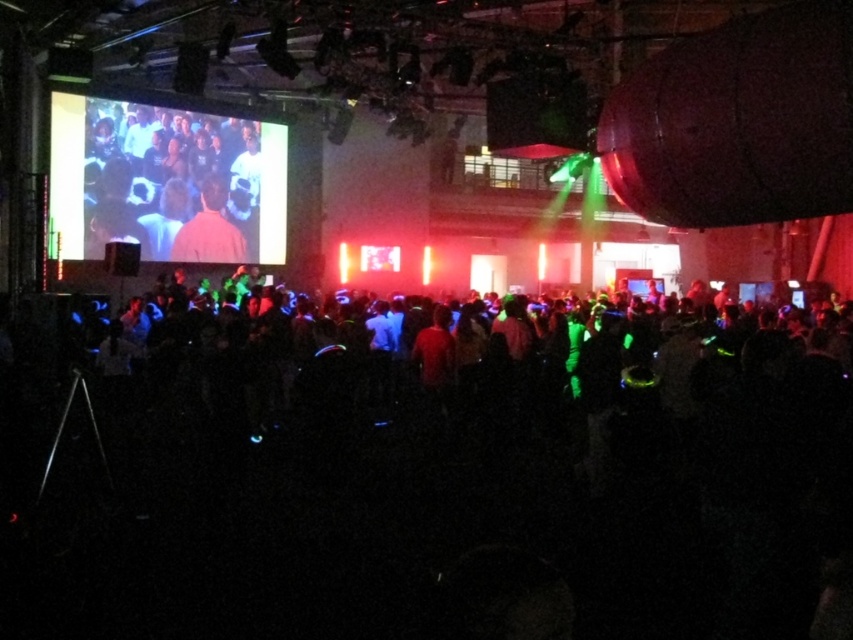
Based on the photo, does neon green glowing crowd at center have a lesser width compared to matte brown shirt at center?

Yes.

Is neon green glowing crowd at center shorter than matte brown shirt at center?

Yes.

Is point (692, 339) in front of point (216, 259)?

Yes, point (692, 339) is in front of point (216, 259).

You are a GUI agent. You are given a task and a screenshot of the screen. Output one action in this format:
    pyautogui.click(x=<x>, y=<y>)
    Task: Click on the neon green glowing crowd at center
    
    Given the screenshot: What is the action you would take?
    pyautogui.click(x=437, y=490)

Is matte black shirt at upper left further to the viewer compared to matte brown shirt at center?

No, matte black shirt at upper left is in front of matte brown shirt at center.

Between point (91, 170) and point (212, 243), which one is positioned in front?

Point (91, 170) is more forward.

Where is `matte black shirt at upper left`? Image resolution: width=853 pixels, height=640 pixels. matte black shirt at upper left is located at coordinates (175, 186).

Between neon green glowing crowd at center and matte black shirt at upper left, which one has more height?

With more height is matte black shirt at upper left.

Between neon green glowing crowd at center and matte black shirt at upper left, which one appears on the right side from the viewer's perspective?

Positioned to the right is neon green glowing crowd at center.

Is point (167, 365) closer to viewer compared to point (112, 184)?

Yes, point (167, 365) is in front of point (112, 184).

The width and height of the screenshot is (853, 640). In order to click on neon green glowing crowd at center in this screenshot , I will do (x=437, y=490).